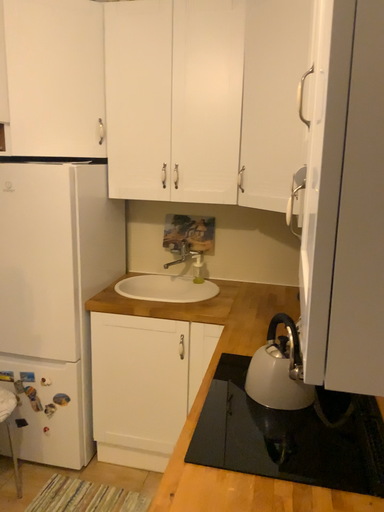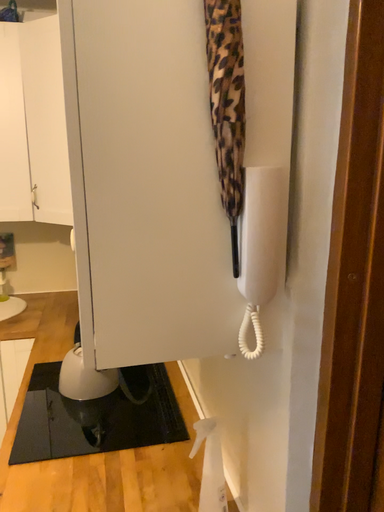
Question: How did the camera likely rotate when shooting the video?

Choices:
 (A) rotated left
 (B) rotated right

Answer: (B)